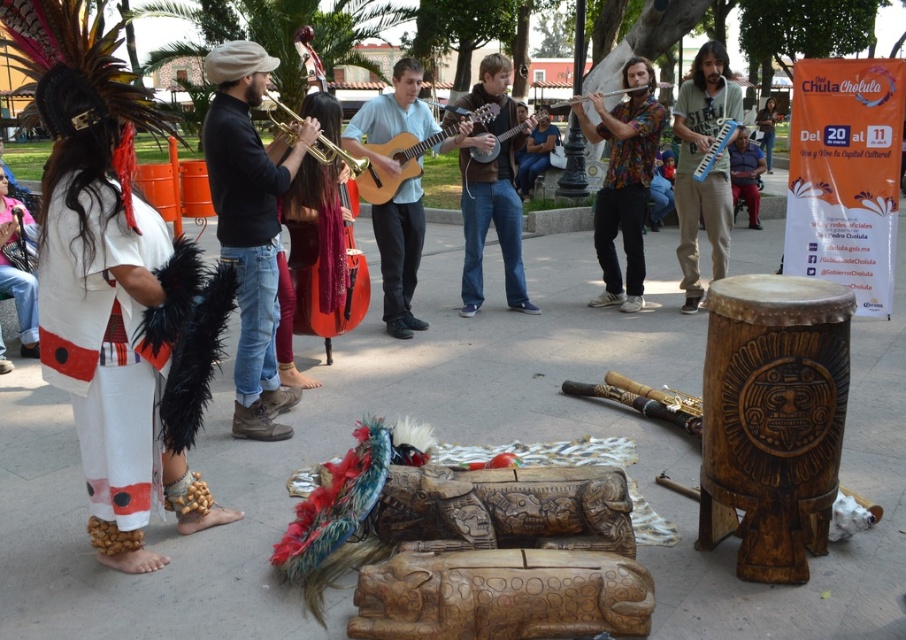
Question: Based on their relative distances, which object is farther from the floral shirt at center?

Choices:
 (A) white feathered headdress at left
 (B) wooden acoustic guitar at center
 (C) matte black trumpet at center

Answer: (A)

Question: Estimate the real-world distances between objects in this image. Which object is closer to the orange plastic drum at center?

Choices:
 (A) blue fabric pants at right
 (B) white fabric with black accents at center

Answer: (B)

Question: Does blue plastic melodica at center appear over orange plastic drum at center?

Choices:
 (A) no
 (B) yes

Answer: (A)

Question: Which object is the farthest from the white feathered headdress at left?

Choices:
 (A) floral shirt at center
 (B) matte brown guitar at center
 (C) white fabric with black accents at center

Answer: (B)

Question: In this image, where is orange plastic drum at center located relative to wooden acoustic guitar at center?

Choices:
 (A) right
 (B) left

Answer: (B)

Question: Can you confirm if wooden guitar at center is bigger than blue fabric pants at right?

Choices:
 (A) yes
 (B) no

Answer: (B)